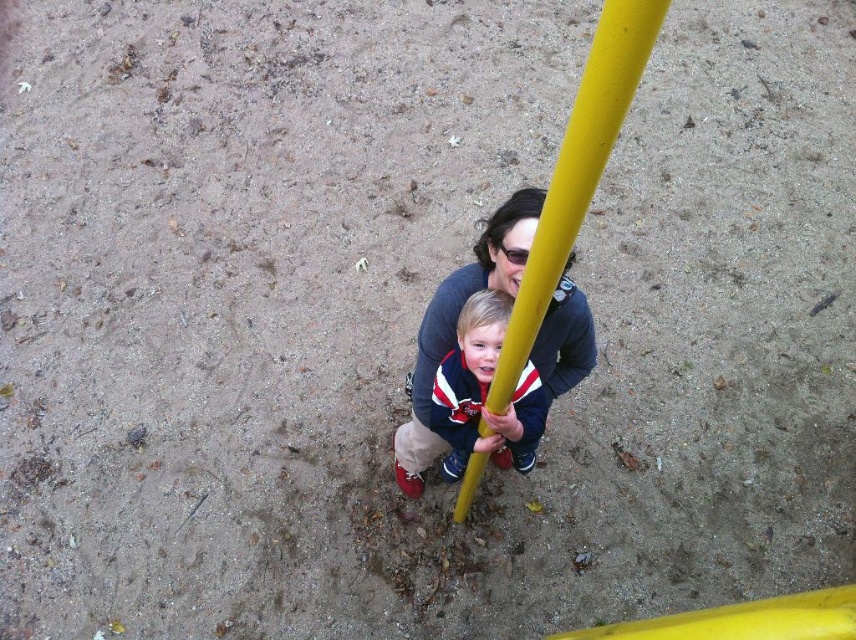
Question: Does yellow matte pole at center lie in front of matte blue sweater at center?

Choices:
 (A) no
 (B) yes

Answer: (B)

Question: Which point is farther to the camera?

Choices:
 (A) [x=602, y=70]
 (B) [x=476, y=262]

Answer: (B)

Question: Based on their relative distances, which object is farther from the yellow matte pole at center?

Choices:
 (A) matte blue jacket at center
 (B) matte blue sweater at center

Answer: (B)

Question: Is matte blue sweater at center wider than matte blue jacket at center?

Choices:
 (A) no
 (B) yes

Answer: (B)

Question: Observing the image, what is the correct spatial positioning of yellow matte pole at center in reference to matte blue sweater at center?

Choices:
 (A) left
 (B) right

Answer: (A)

Question: Which of the following is the closest to the observer?

Choices:
 (A) (435, 323)
 (B) (569, 193)
 (C) (492, 316)

Answer: (B)